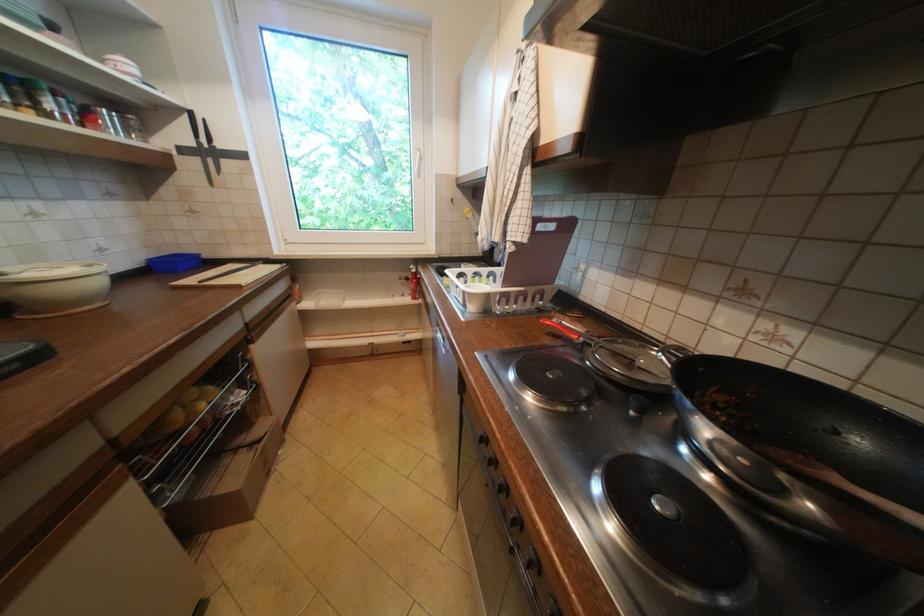
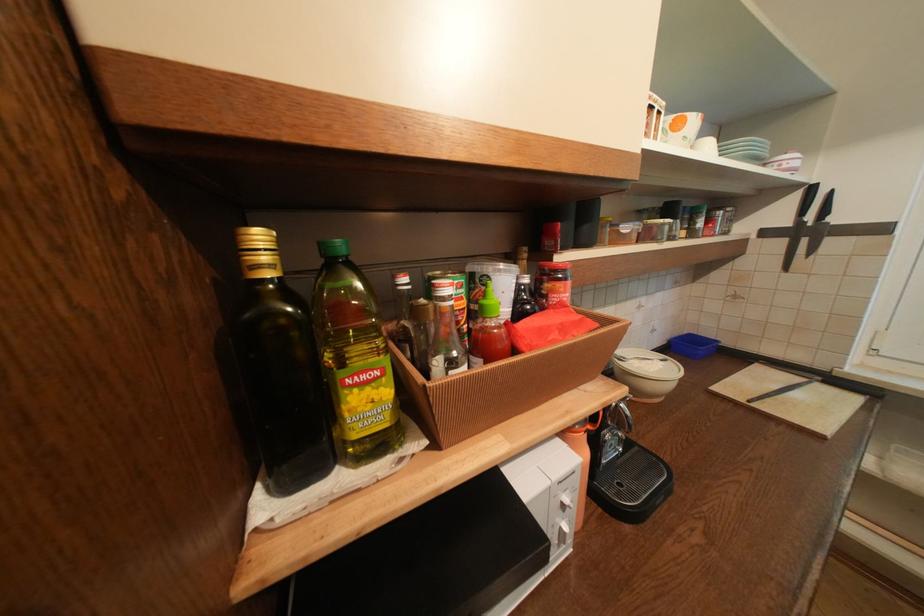
Where in the second image is the point corresponding to (219,161) from the first image?

(812, 241)